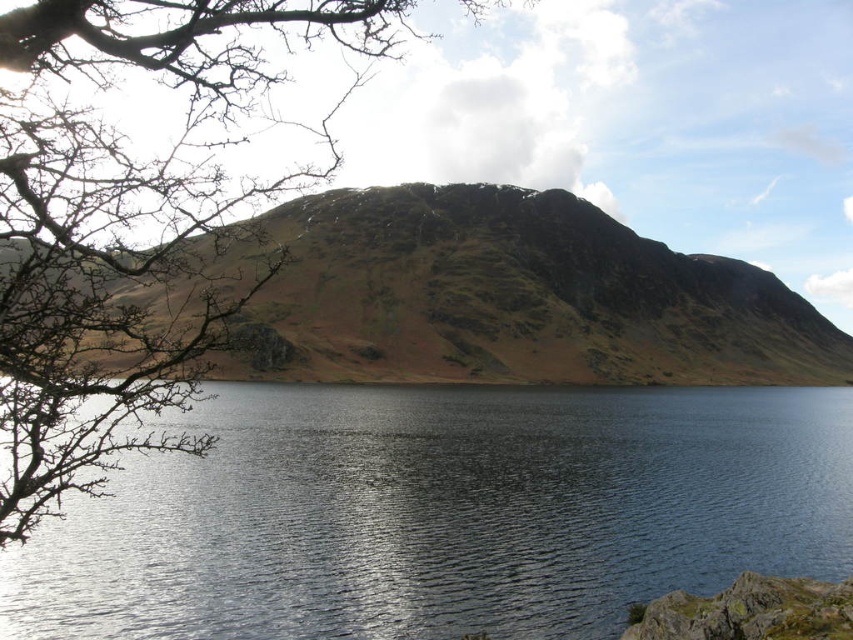
Question: Is the position of blue reflective water at center more distant than that of bare branches at left?

Choices:
 (A) yes
 (B) no

Answer: (A)

Question: Among these points, which one is farthest from the camera?

Choices:
 (A) (117, 35)
 (B) (733, 365)
 (C) (428, 522)

Answer: (B)

Question: Is blue reflective water at center smaller than brown rocky mountain at upper center?

Choices:
 (A) no
 (B) yes

Answer: (B)

Question: Is blue reflective water at center positioned behind brown rocky mountain at upper center?

Choices:
 (A) no
 (B) yes

Answer: (A)

Question: Which of the following is the closest to the observer?

Choices:
 (A) blue reflective water at center
 (B) brown rocky mountain at upper center
 (C) bare branches at left

Answer: (C)

Question: Among these objects, which one is farthest from the camera?

Choices:
 (A) bare branches at left
 (B) brown rocky mountain at upper center

Answer: (B)